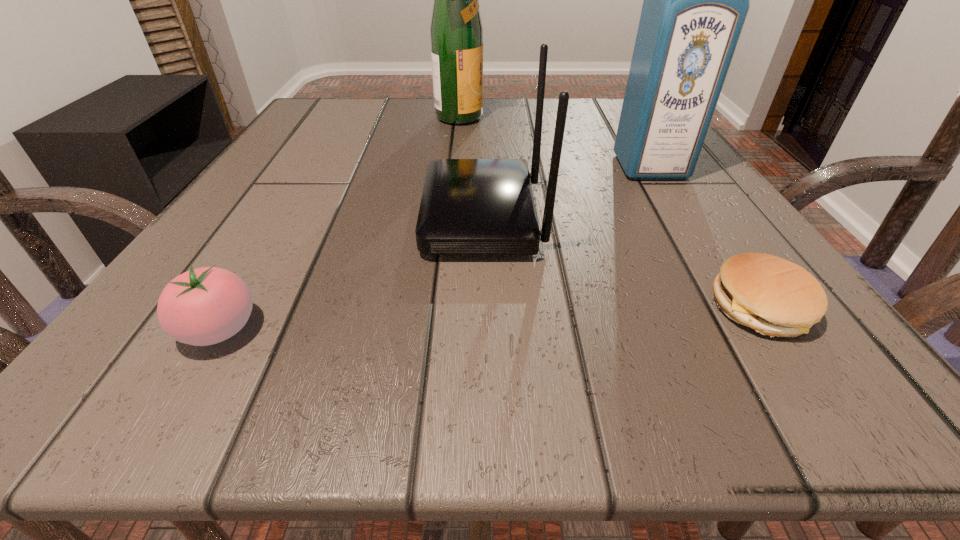
At what (x,y) coordinates should I click in order to perform the action: click on object at the near left corner. Please return your answer as a coordinate pair (x, y). The width and height of the screenshot is (960, 540). Looking at the image, I should click on (204, 306).

The image size is (960, 540). In order to click on object positioned at the near right corner in this screenshot , I will do `click(776, 297)`.

The width and height of the screenshot is (960, 540). Identify the location of vacant space at the far edge of the desktop. (381, 125).

In the image, there is a desktop. Find the location of `blank space at the near edge`. blank space at the near edge is located at coordinates (x=292, y=366).

The image size is (960, 540). Identify the location of vacant area at the left edge of the desktop. (350, 158).

You are a GUI agent. You are given a task and a screenshot of the screen. Output one action in this format:
    pyautogui.click(x=<x>, y=<y>)
    Task: Click on the vacant space at the right edge of the desktop
    This screenshot has height=540, width=960.
    Given the screenshot: What is the action you would take?
    pyautogui.click(x=628, y=178)

Image resolution: width=960 pixels, height=540 pixels. Find the location of `vacant region at the far left corner of the desktop`. vacant region at the far left corner of the desktop is located at coordinates (291, 136).

Locate an element on the screen. This screenshot has height=540, width=960. free space at the near left corner is located at coordinates (189, 370).

Where is `vacant space at the far right corner`? The image size is (960, 540). vacant space at the far right corner is located at coordinates (601, 112).

Where is `unoccupied position between the third tallest object and the nearer liquor`? unoccupied position between the third tallest object and the nearer liquor is located at coordinates (566, 192).